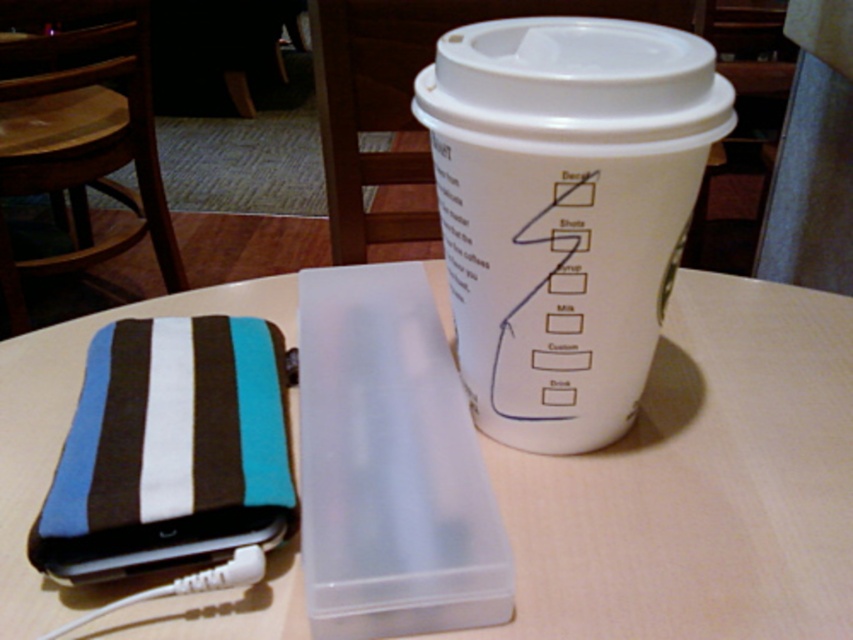
In the scene shown: You are a customer at a cafe and see the white plastic container at center and the white paper cup at upper right on the table. Which item is positioned closer to the left side of the table?

The white plastic container at center is positioned to the left of the white paper cup at upper right, so it is closer to the left side of the table.

You are a barista preparing a customer order. The customer has placed their striped wallet on the table. Where should you place the white plastic container at center to avoid covering the wallet?

You should place the white plastic container at center to the right of the striped wallet since the white plastic container at center is located at point (700, 484), which is to the right of the wallet.